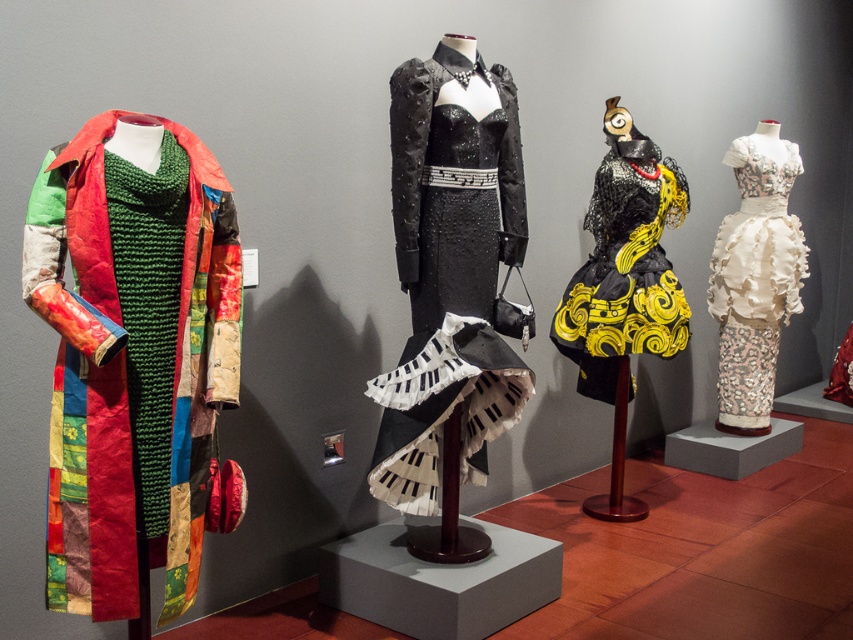
From the picture: You are standing in front of the first mannequin at the left. You see a point marked at coordinates (132, 355). Can you tell me what type of fabric this point is located on?

The point at coordinates (132, 355) is on the patchwork fabric coat at left.

You are standing in front of the first mannequin wearing the colorful patchwork coat. There are two points marked on the coat at coordinates point (x=192, y=248) and point (x=682, y=324). Which point is closer to you?

Point (x=192, y=248) is closer to the viewer than point (x=682, y=324).

You are a fashion designer observing the display. Which of the two garments, the patchwork fabric coat at left or the white lace dress at upper right, would require more fabric to produce?

The white lace dress at upper right requires more fabric to produce since it is larger in size than the patchwork fabric coat at left.